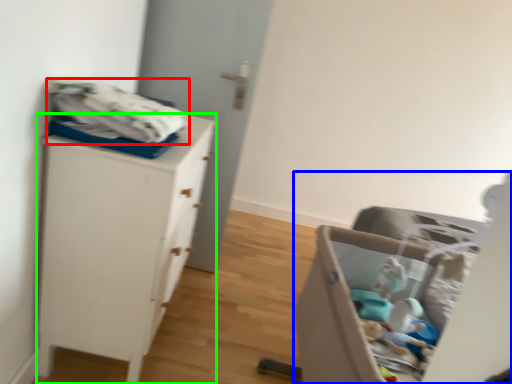
Question: Considering the real-world distances, which object is farthest from baby clothe (highlighted by a red box)? furniture (highlighted by a blue box) or chest of drawers (highlighted by a green box)?

Choices:
 (A) furniture
 (B) chest of drawers

Answer: (A)